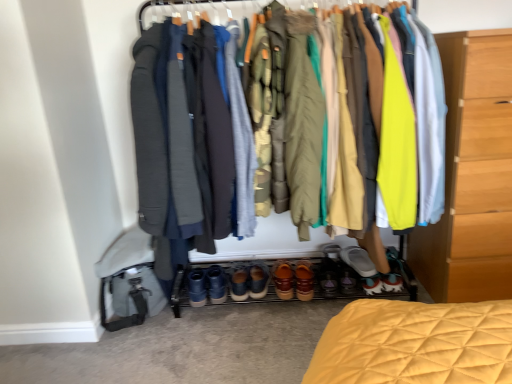
Question: From a real-world perspective, is light wood chest of drawers at right physically above gray wool robe at center, positioned as the 3th robe in left-to-right order?

Choices:
 (A) no
 (B) yes

Answer: (A)

Question: Considering the relative sizes of light wood chest of drawers at right and gray wool robe at center, positioned as the 3th robe in left-to-right order, in the image provided, is light wood chest of drawers at right wider than gray wool robe at center, positioned as the 3th robe in left-to-right order,?

Choices:
 (A) no
 (B) yes

Answer: (A)

Question: Would you say gray wool robe at center, positioned as the 3th robe in left-to-right order, is part of light wood chest of drawers at right's contents?

Choices:
 (A) yes
 (B) no

Answer: (B)

Question: Is light wood chest of drawers at right thinner than gray wool robe at center, which is the second robe from right to left?

Choices:
 (A) yes
 (B) no

Answer: (A)

Question: Are light wood chest of drawers at right and gray wool robe at center, positioned as the 3th robe in left-to-right order, beside each other?

Choices:
 (A) no
 (B) yes

Answer: (A)

Question: In terms of size, does gray wool robe at center, which is the second robe from right to left, appear bigger or smaller than leather suede shoes at center, which appears as the 1th footwear when viewed from the left?

Choices:
 (A) big
 (B) small

Answer: (A)

Question: From the image's perspective, relative to leather suede shoes at center, placed as the sixth footwear when sorted from right to left, is gray wool robe at center, which is the second robe from right to left, above or below?

Choices:
 (A) above
 (B) below

Answer: (A)

Question: Is gray wool robe at center, positioned as the 3th robe in left-to-right order, in front of or behind leather suede shoes at center, which appears as the 1th footwear when viewed from the left, in the image?

Choices:
 (A) behind
 (B) front

Answer: (B)

Question: Is gray wool robe at center, positioned as the 3th robe in left-to-right order, situated inside leather suede shoes at center, placed as the sixth footwear when sorted from right to left, or outside?

Choices:
 (A) outside
 (B) inside

Answer: (A)

Question: Is leather shoes at center, which ranks as the 4th footwear in left-to-right order, wider or thinner than matte yellow jacket at right?

Choices:
 (A) wide
 (B) thin

Answer: (B)

Question: Considering the positions of point (368, 294) and point (406, 172), is point (368, 294) closer or farther from the camera than point (406, 172)?

Choices:
 (A) closer
 (B) farther

Answer: (B)

Question: In terms of size, does leather shoes at center, which appears as the 3th footwear when viewed from the right, appear bigger or smaller than matte yellow jacket at right?

Choices:
 (A) big
 (B) small

Answer: (B)

Question: From the image's perspective, is leather shoes at center, which ranks as the 4th footwear in left-to-right order, located above or below matte yellow jacket at right?

Choices:
 (A) below
 (B) above

Answer: (A)

Question: From the image's perspective, relative to brown leather shoes at center, arranged as the 4th footwear when viewed from the right, is white fabric shoe at lower center, the 1th footwear viewed from the right, above or below?

Choices:
 (A) below
 (B) above

Answer: (B)

Question: Is white fabric shoe at lower center, the 1th footwear viewed from the right, bigger or smaller than brown leather shoes at center, arranged as the 4th footwear when viewed from the right?

Choices:
 (A) big
 (B) small

Answer: (B)